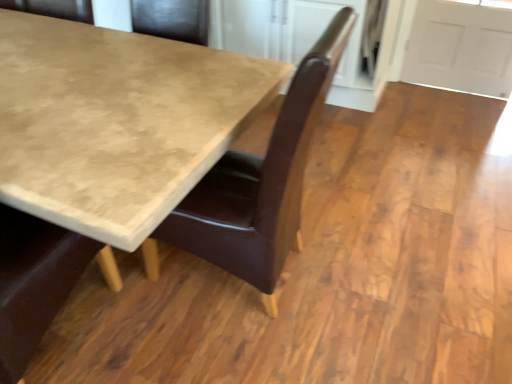
Find the location of a particular element. The width and height of the screenshot is (512, 384). unoccupied area in front of brown leather chair at center is located at coordinates pos(229,348).